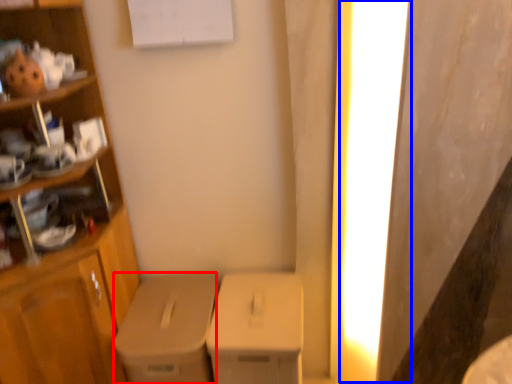
Question: Which object appears farthest to the camera in this image, cardboard box (highlighted by a red box) or lighting (highlighted by a blue box)?

Choices:
 (A) cardboard box
 (B) lighting

Answer: (A)